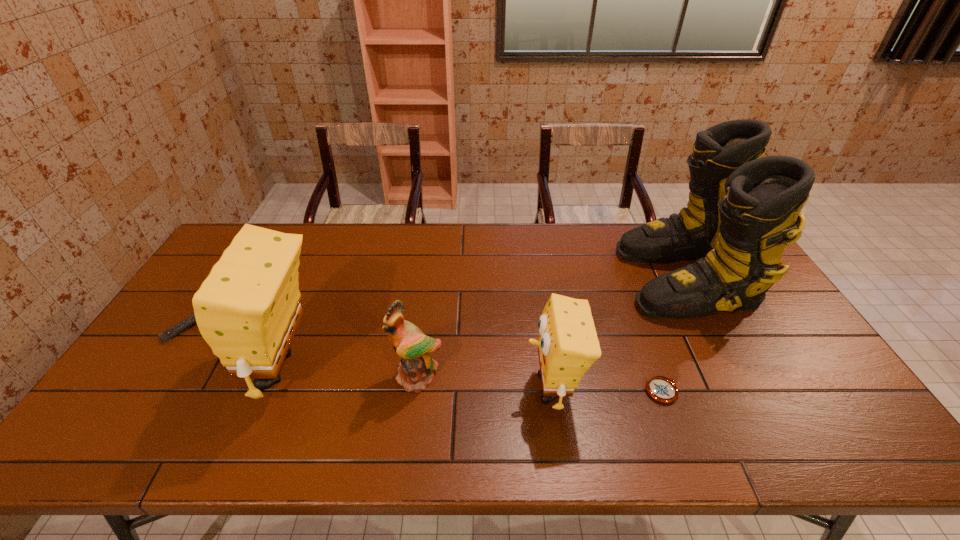
The image size is (960, 540). Find the location of `object present at the left edge`. object present at the left edge is located at coordinates pyautogui.click(x=167, y=335).

At what (x,y) coordinates should I click in order to perform the action: click on object that is at the right edge. Please return your answer as a coordinate pair (x, y). Looking at the image, I should click on (743, 208).

Find the location of a particular element. The height and width of the screenshot is (540, 960). object that is at the far right corner is located at coordinates (743, 208).

The height and width of the screenshot is (540, 960). Identify the location of vacant position at the far edge of the desktop. (637, 226).

You are a GUI agent. You are given a task and a screenshot of the screen. Output one action in this format:
    pyautogui.click(x=<x>, y=<y>)
    Task: Click on the vacant space at the near edge of the desktop
    Image resolution: width=960 pixels, height=540 pixels.
    Given the screenshot: What is the action you would take?
    pyautogui.click(x=216, y=386)

The width and height of the screenshot is (960, 540). In order to click on vacant space at the left edge in this screenshot , I will do `click(189, 374)`.

Image resolution: width=960 pixels, height=540 pixels. Find the location of `vacant area at the right edge`. vacant area at the right edge is located at coordinates (747, 328).

This screenshot has width=960, height=540. I want to click on vacant space at the far left corner of the desktop, so click(226, 244).

This screenshot has width=960, height=540. In the image, there is a desktop. Find the location of `vacant space at the near right corner`. vacant space at the near right corner is located at coordinates (x=851, y=411).

I want to click on free space between the compass and the second tallest object, so click(x=472, y=380).